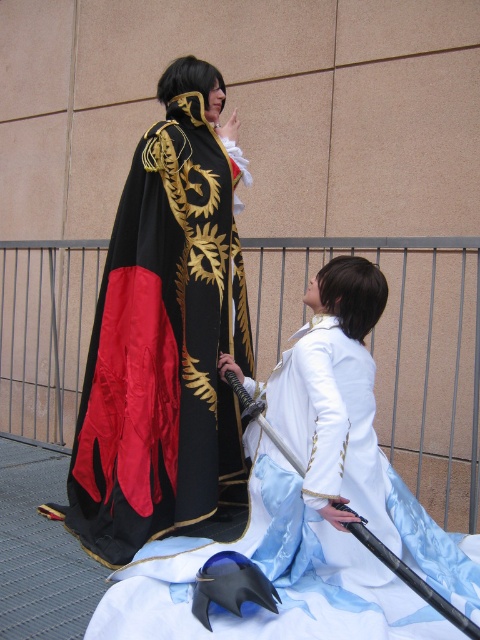
You are a costume designer working on a historical drama. You need to place a velvet black cape at center in the scene. Where exactly should you position it?

The velvet black cape at center should be positioned at point (167, 340) to match the scene description.

You are a costume designer observing the scene. You need to determine which costume is visible on top. Which one is the velvet black cape at center and the satin white dress at center?

The velvet black cape at center is positioned over the satin white dress at center, making it the visible top layer.